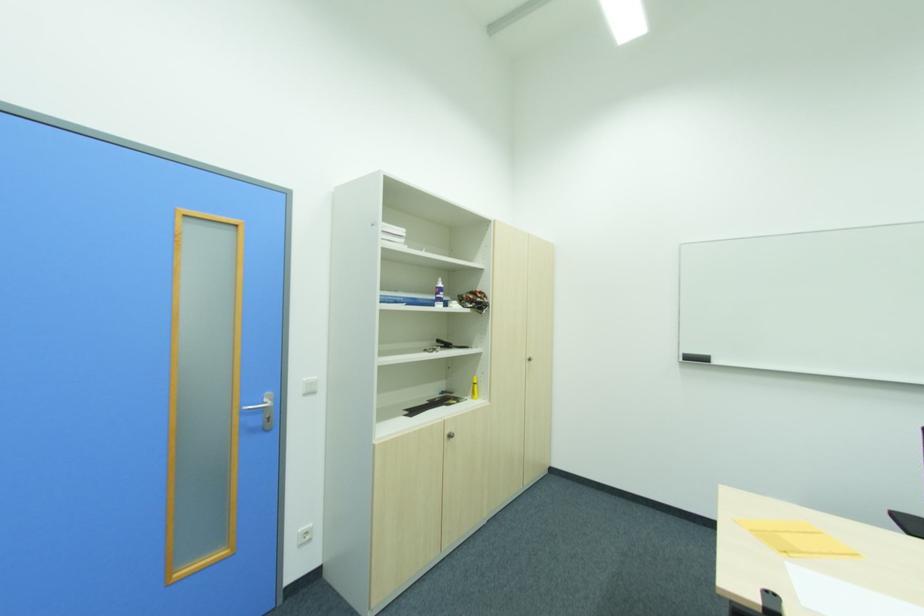
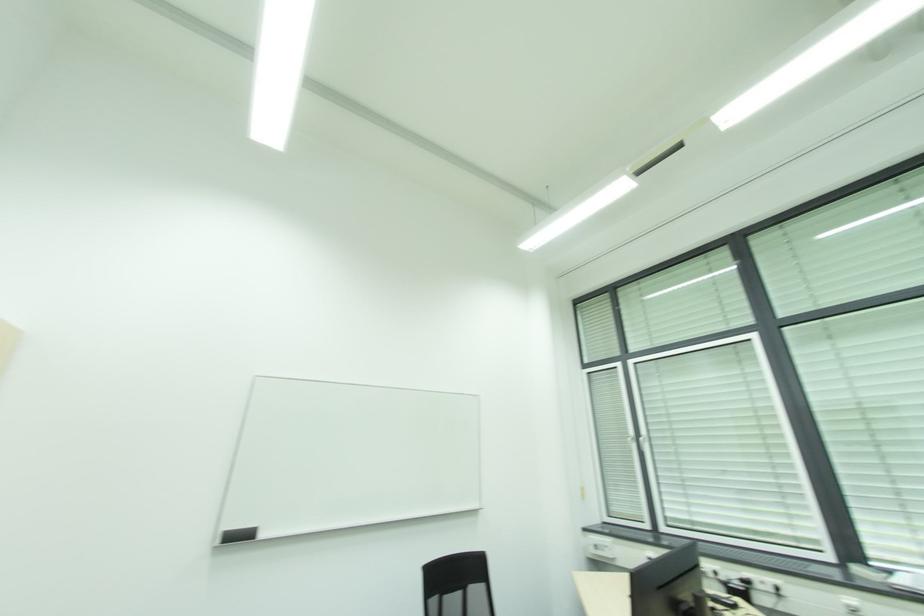
The first image is from the beginning of the video and the second image is from the end. How did the camera likely rotate when shooting the video?

The camera rotated toward right-up.